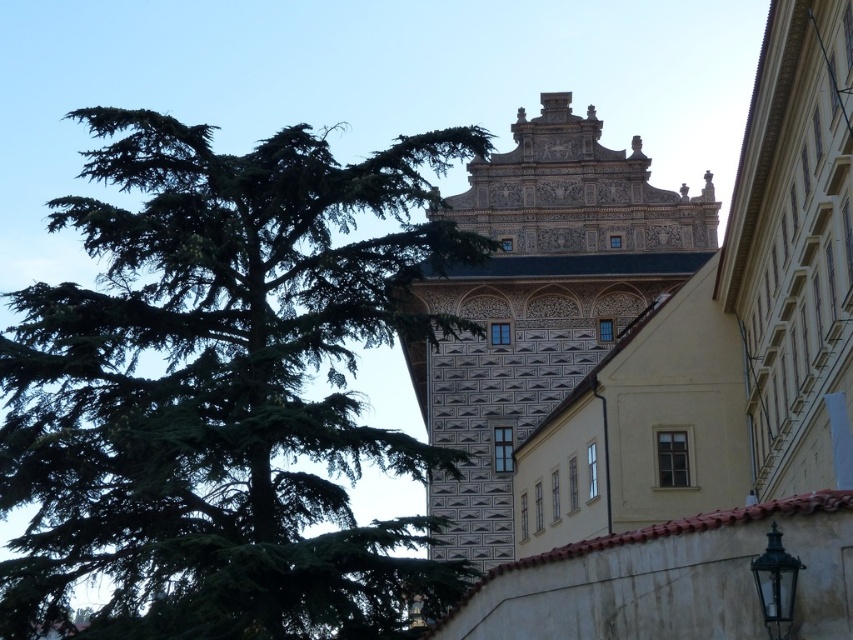
Question: Which of the following is the farthest from the observer?

Choices:
 (A) dark brown stone tower at center
 (B) green needle-like tree at left

Answer: (A)

Question: Which of the following is the farthest from the observer?

Choices:
 (A) (618, 285)
 (B) (398, 605)

Answer: (A)

Question: Among these points, which one is nearest to the camera?

Choices:
 (A) (558, 400)
 (B) (358, 456)

Answer: (B)

Question: Can you confirm if green needle-like tree at left is smaller than dark brown stone tower at center?

Choices:
 (A) no
 (B) yes

Answer: (A)

Question: Does green needle-like tree at left appear over dark brown stone tower at center?

Choices:
 (A) no
 (B) yes

Answer: (A)

Question: Observing the image, what is the correct spatial positioning of green needle-like tree at left in reference to dark brown stone tower at center?

Choices:
 (A) below
 (B) above

Answer: (A)